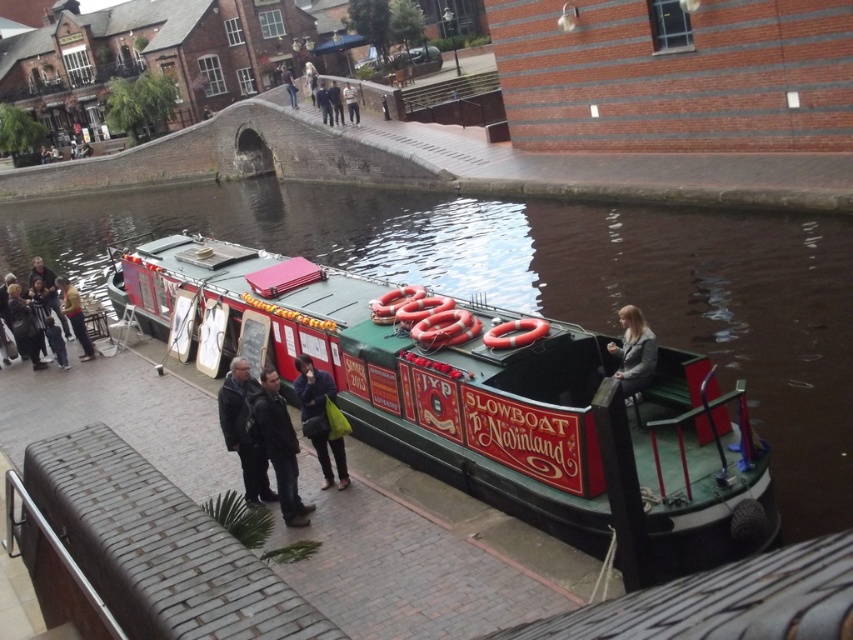
Between brick dock at lower left and matte black jacket at lower left, which one has less height?

matte black jacket at lower left

Can you confirm if brick dock at lower left is thinner than matte black jacket at lower left?

No, brick dock at lower left is not thinner than matte black jacket at lower left.

Locate an element on the screen. brick dock at lower left is located at coordinates (158, 547).

The height and width of the screenshot is (640, 853). In order to click on brick dock at lower left in this screenshot , I will do [158, 547].

Is green painted wood boat at center below matte black jacket at lower left?

Incorrect, green painted wood boat at center is not positioned below matte black jacket at lower left.

From the picture: Does green painted wood boat at center have a greater width compared to matte black jacket at lower left?

Yes, green painted wood boat at center is wider than matte black jacket at lower left.

Between point (766, 538) and point (33, 291), which one is positioned behind?

Positioned behind is point (33, 291).

Identify the location of green painted wood boat at center. (410, 372).

Is brick dock at lower left wider than light blue jeans at center?

In fact, brick dock at lower left might be narrower than light blue jeans at center.

Who is positioned more to the right, brick dock at lower left or light blue jeans at center?

From the viewer's perspective, brick dock at lower left appears more on the right side.

Which is behind, point (164, 560) or point (281, 76)?

Positioned behind is point (281, 76).

Find the location of a particular element. brick dock at lower left is located at coordinates (158, 547).